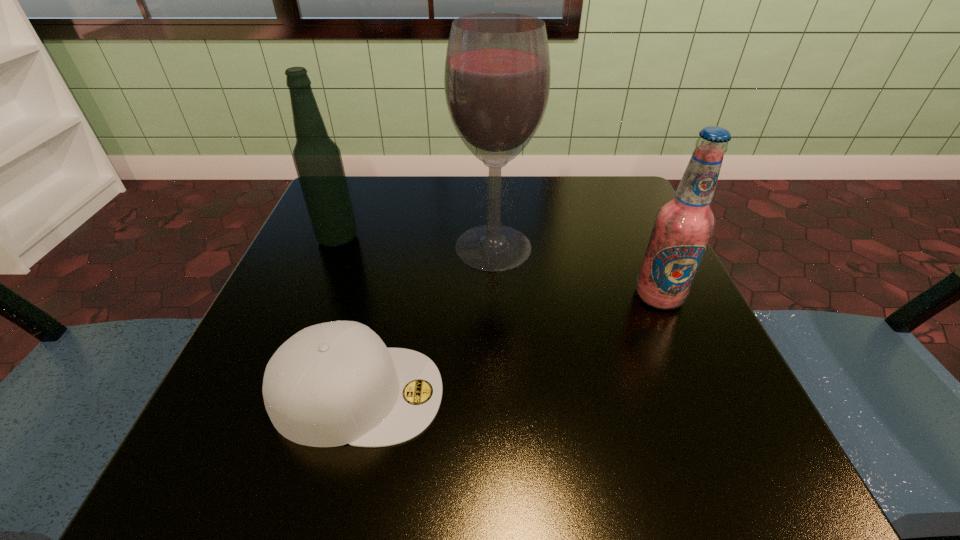
Where is `free space at the right edge`? The height and width of the screenshot is (540, 960). free space at the right edge is located at coordinates (639, 324).

The width and height of the screenshot is (960, 540). What are the coordinates of `vacant space at the far left corner of the desktop` in the screenshot? It's located at (361, 218).

The height and width of the screenshot is (540, 960). I want to click on free space at the near left corner of the desktop, so click(x=191, y=449).

Identify the location of vacant area at the near right corner. This screenshot has height=540, width=960. (661, 485).

Where is `free spot between the tallest alcohol and the leftmost alcohol`? free spot between the tallest alcohol and the leftmost alcohol is located at coordinates (416, 243).

The image size is (960, 540). Identify the location of unoccupied area between the leftmost alcohol and the cap. (348, 316).

The image size is (960, 540). I want to click on free spot between the rightmost object and the shortest object, so click(x=508, y=345).

This screenshot has width=960, height=540. I want to click on free space between the leftmost alcohol and the cap, so click(348, 316).

Where is `free space that is in between the second alcohol from right to left and the nearest object`? The height and width of the screenshot is (540, 960). free space that is in between the second alcohol from right to left and the nearest object is located at coordinates (425, 320).

You are a GUI agent. You are given a task and a screenshot of the screen. Output one action in this format:
    pyautogui.click(x=<x>, y=<y>)
    Task: Click on the empty location between the leftmost alcohol and the tallest object
    The width and height of the screenshot is (960, 540).
    Given the screenshot: What is the action you would take?
    pyautogui.click(x=416, y=243)